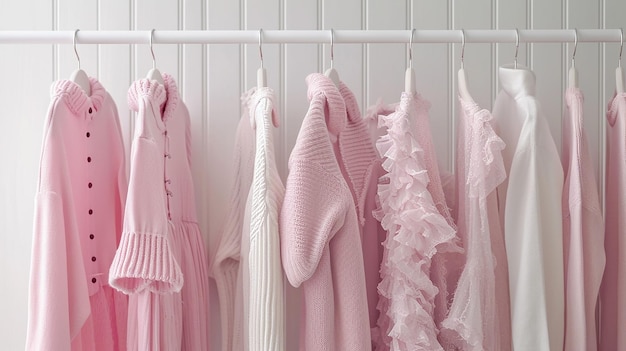
Where is `hangers`? hangers is located at coordinates (84, 81), (158, 72), (267, 81), (336, 71), (413, 72), (464, 67), (515, 67), (578, 78), (623, 82).